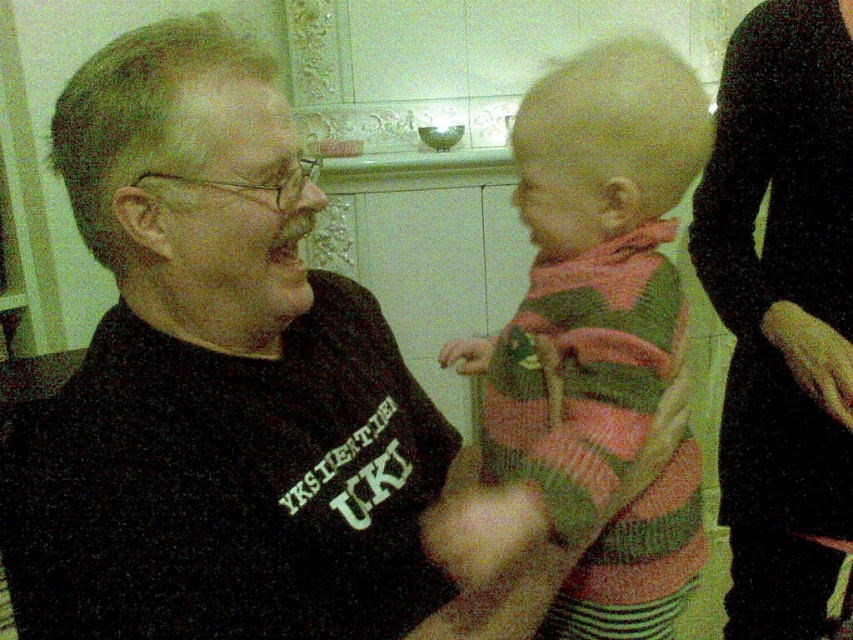
Question: Is the position of knitted sweater at center more distant than that of black fabric dress at right?

Choices:
 (A) yes
 (B) no

Answer: (B)

Question: Does knitted sweater at center appear under black fabric dress at right?

Choices:
 (A) yes
 (B) no

Answer: (B)

Question: Which of the following is the closest to the observer?

Choices:
 (A) knitted sweater at center
 (B) black fabric dress at right

Answer: (A)

Question: From the image, what is the correct spatial relationship of knitted sweater at center in relation to black fabric dress at right?

Choices:
 (A) below
 (B) above

Answer: (B)